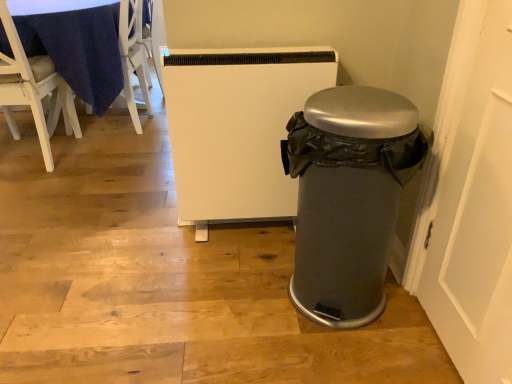
This screenshot has height=384, width=512. Describe the element at coordinates (133, 58) in the screenshot. I see `white wood chair at upper left, arranged as the 2th chair when viewed from the left` at that location.

Find the location of a particular element. white wood chair at upper left, arranged as the 2th chair when viewed from the left is located at coordinates (133, 58).

Measure the distance between white wood chair at left, marked as the 2th chair in a right-to-left arrangement, and camera.

white wood chair at left, marked as the 2th chair in a right-to-left arrangement, is 5.96 feet away from camera.

What is the approximate width of white wood chair at left, marked as the 2th chair in a right-to-left arrangement?

21.41 inches.

What do you see at coordinates (34, 90) in the screenshot? I see `white wood chair at left, placed as the first chair when sorted from left to right` at bounding box center [34, 90].

Where is `white wood chair at left, placed as the first chair when sorted from left to right`? white wood chair at left, placed as the first chair when sorted from left to right is located at coordinates (34, 90).

Find the location of a particular element. This screenshot has height=384, width=512. white wood chair at upper left, arranged as the 2th chair when viewed from the left is located at coordinates (133, 58).

Is white wood chair at upper left, arranged as the 2th chair when viewed from the left, at the left side of white wood chair at left, marked as the 2th chair in a right-to-left arrangement?

No, white wood chair at upper left, arranged as the 2th chair when viewed from the left, is not to the left of white wood chair at left, marked as the 2th chair in a right-to-left arrangement.

Based on the photo, relative to white wood chair at left, marked as the 2th chair in a right-to-left arrangement, is white wood chair at upper left, the 1th chair viewed from the right, in front or behind?

In the image, white wood chair at upper left, the 1th chair viewed from the right, appears behind white wood chair at left, marked as the 2th chair in a right-to-left arrangement.

Which point is more distant from viewer, (136, 68) or (47, 128)?

The point (136, 68) is farther from the camera.

From the image's perspective, is white wood chair at upper left, the 1th chair viewed from the right, located above or below white wood chair at left, placed as the first chair when sorted from left to right?

white wood chair at upper left, the 1th chair viewed from the right, is above white wood chair at left, placed as the first chair when sorted from left to right.

From a real-world perspective, does white wood chair at upper left, arranged as the 2th chair when viewed from the left, sit lower than white wood chair at left, marked as the 2th chair in a right-to-left arrangement?

Yes.

Considering the sizes of objects white wood chair at upper left, the 1th chair viewed from the right, and white wood chair at left, marked as the 2th chair in a right-to-left arrangement, in the image provided, who is thinner, white wood chair at upper left, the 1th chair viewed from the right, or white wood chair at left, marked as the 2th chair in a right-to-left arrangement,?

With smaller width is white wood chair at upper left, the 1th chair viewed from the right.

Is white wood chair at upper left, arranged as the 2th chair when viewed from the left, shorter than white wood chair at left, marked as the 2th chair in a right-to-left arrangement?

Yes, white wood chair at upper left, arranged as the 2th chair when viewed from the left, is shorter than white wood chair at left, marked as the 2th chair in a right-to-left arrangement.

In the scene shown: Considering the relative sizes of white wood chair at upper left, the 1th chair viewed from the right, and white wood chair at left, marked as the 2th chair in a right-to-left arrangement, in the image provided, is white wood chair at upper left, the 1th chair viewed from the right, smaller than white wood chair at left, marked as the 2th chair in a right-to-left arrangement,?

Correct, white wood chair at upper left, the 1th chair viewed from the right, occupies less space than white wood chair at left, marked as the 2th chair in a right-to-left arrangement.

Would you say white wood chair at upper left, the 1th chair viewed from the right, is inside or outside white wood chair at left, marked as the 2th chair in a right-to-left arrangement?

white wood chair at upper left, the 1th chair viewed from the right, is not enclosed by white wood chair at left, marked as the 2th chair in a right-to-left arrangement.

Based on the photo, are white wood chair at upper left, arranged as the 2th chair when viewed from the left, and white wood chair at left, placed as the first chair when sorted from left to right, located far from each other?

No, white wood chair at upper left, arranged as the 2th chair when viewed from the left, is not far away from white wood chair at left, placed as the first chair when sorted from left to right.

Is white wood chair at upper left, arranged as the 2th chair when viewed from the left, facing towards white wood chair at left, placed as the first chair when sorted from left to right?

No, white wood chair at upper left, arranged as the 2th chair when viewed from the left, is not facing towards white wood chair at left, placed as the first chair when sorted from left to right.

Based on the photo, measure the distance between white wood chair at upper left, the 1th chair viewed from the right, and white wood chair at left, placed as the first chair when sorted from left to right.

They are 19.28 inches apart.

Find the location of a particular element. The height and width of the screenshot is (384, 512). chair below the white wood chair at left, marked as the 2th chair in a right-to-left arrangement (from a real-world perspective) is located at coordinates (133, 58).

Between white wood chair at left, placed as the first chair when sorted from left to right, and white wood chair at upper left, arranged as the 2th chair when viewed from the left, which one appears on the left side from the viewer's perspective?

white wood chair at left, placed as the first chair when sorted from left to right.

Which is in front, white wood chair at left, marked as the 2th chair in a right-to-left arrangement, or white wood chair at upper left, arranged as the 2th chair when viewed from the left?

white wood chair at left, marked as the 2th chair in a right-to-left arrangement.

Does point (66, 90) appear closer or farther from the camera than point (139, 119)?

Point (66, 90) is closer to the camera than point (139, 119).

From the image's perspective, is white wood chair at left, marked as the 2th chair in a right-to-left arrangement, on white wood chair at upper left, the 1th chair viewed from the right?

No, from the image's perspective, white wood chair at left, marked as the 2th chair in a right-to-left arrangement, is not over white wood chair at upper left, the 1th chair viewed from the right.

From a real-world perspective, is white wood chair at left, marked as the 2th chair in a right-to-left arrangement, physically below white wood chair at upper left, the 1th chair viewed from the right?

No, from a real-world perspective, white wood chair at left, marked as the 2th chair in a right-to-left arrangement, is not beneath white wood chair at upper left, the 1th chair viewed from the right.

Considering the sizes of white wood chair at left, placed as the first chair when sorted from left to right, and white wood chair at upper left, the 1th chair viewed from the right, in the image, is white wood chair at left, placed as the first chair when sorted from left to right, wider or thinner than white wood chair at upper left, the 1th chair viewed from the right,?

Considering their sizes, white wood chair at left, placed as the first chair when sorted from left to right, looks broader than white wood chair at upper left, the 1th chair viewed from the right.

Can you confirm if white wood chair at left, marked as the 2th chair in a right-to-left arrangement, is taller than white wood chair at upper left, the 1th chair viewed from the right?

Yes, white wood chair at left, marked as the 2th chair in a right-to-left arrangement, is taller than white wood chair at upper left, the 1th chair viewed from the right.

In terms of size, does white wood chair at left, marked as the 2th chair in a right-to-left arrangement, appear bigger or smaller than white wood chair at upper left, the 1th chair viewed from the right?

Clearly, white wood chair at left, marked as the 2th chair in a right-to-left arrangement, is larger in size than white wood chair at upper left, the 1th chair viewed from the right.

Consider the image. Is white wood chair at left, placed as the first chair when sorted from left to right, spatially inside white wood chair at upper left, arranged as the 2th chair when viewed from the left, or outside of it?

white wood chair at left, placed as the first chair when sorted from left to right, is not enclosed by white wood chair at upper left, arranged as the 2th chair when viewed from the left.

Is white wood chair at left, placed as the first chair when sorted from left to right, turned away from white wood chair at upper left, the 1th chair viewed from the right?

That's not correct — white wood chair at left, placed as the first chair when sorted from left to right, is not looking away from white wood chair at upper left, the 1th chair viewed from the right.

How far apart are white wood chair at left, marked as the 2th chair in a right-to-left arrangement, and white wood chair at upper left, arranged as the 2th chair when viewed from the left?

19.28 inches.

The image size is (512, 384). Identify the location of chair that appears on the left of white wood chair at upper left, arranged as the 2th chair when viewed from the left. (34, 90).

Identify the location of chair behind the white wood chair at left, marked as the 2th chair in a right-to-left arrangement. This screenshot has height=384, width=512. (133, 58).

Find the location of a particular element. chair on the left of white wood chair at upper left, arranged as the 2th chair when viewed from the left is located at coordinates (34, 90).